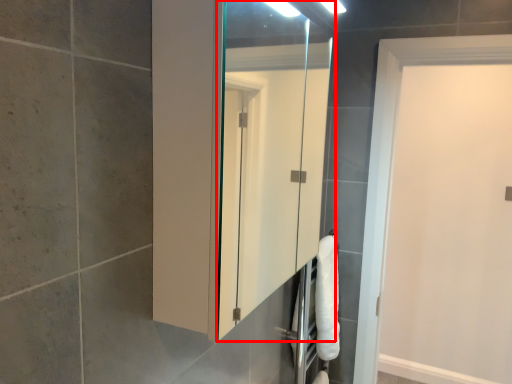
Question: Where is mirror (annotated by the red box) located in relation to door in the image?

Choices:
 (A) left
 (B) right

Answer: (A)